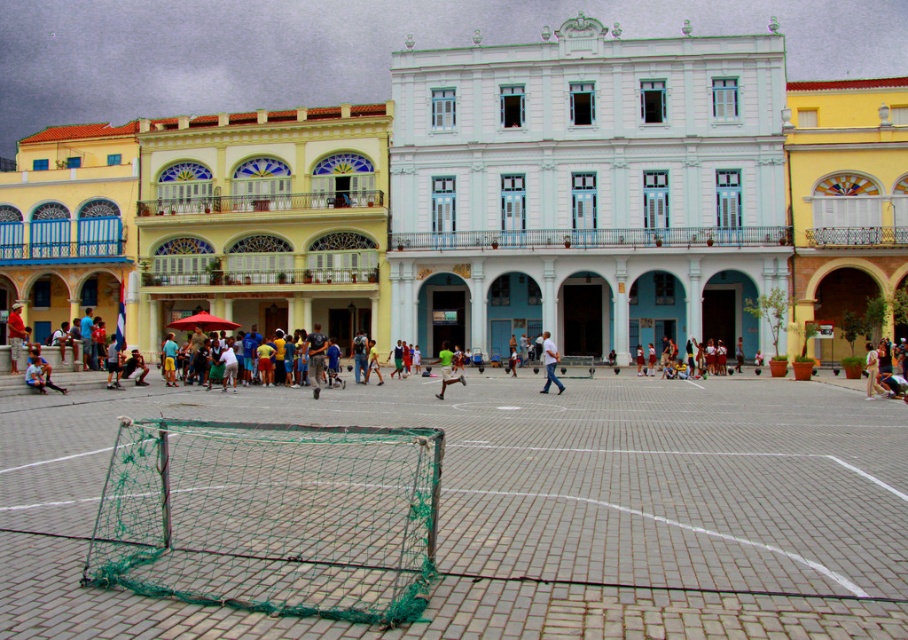
How far apart are white matte pants at center and green jersey at center?

white matte pants at center is 14.34 feet away from green jersey at center.

Is point (551, 342) closer to camera compared to point (454, 381)?

No.

Where is `white matte pants at center`? Image resolution: width=908 pixels, height=640 pixels. white matte pants at center is located at coordinates (549, 362).

This screenshot has height=640, width=908. Describe the element at coordinates (881, 371) in the screenshot. I see `white cotton shirt at center` at that location.

Which is behind, point (894, 380) or point (43, 387)?

Positioned behind is point (894, 380).

This screenshot has width=908, height=640. Identify the location of white cotton shirt at center. (881, 371).

Which of these two, light blue fabric shorts at lower left or green jersey at center, stands taller?

With more height is green jersey at center.

Is point (37, 385) positioned after point (441, 397)?

That is False.

This screenshot has width=908, height=640. What are the coordinates of `light blue fabric shorts at lower left` in the screenshot? It's located at (38, 372).